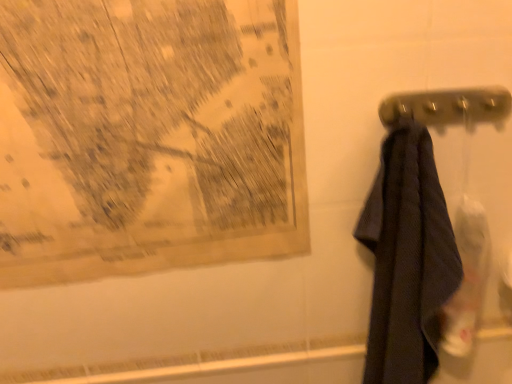
Where is `metallic gray towel bar at right`? metallic gray towel bar at right is located at coordinates (447, 107).

What do you see at coordinates (447, 107) in the screenshot?
I see `metallic gray towel bar at right` at bounding box center [447, 107].

Where is `yellowed paper map at upper left`? The height and width of the screenshot is (384, 512). yellowed paper map at upper left is located at coordinates (148, 136).

You are a GUI agent. You are given a task and a screenshot of the screen. Output one action in this format:
    pyautogui.click(x=<x>, y=<y>)
    Task: Click on the metallic gray towel bar at right
    
    Given the screenshot: What is the action you would take?
    pyautogui.click(x=447, y=107)

Looking at this image, is metallic gray towel bar at right far away from yellowed paper map at upper left?

No, metallic gray towel bar at right is not far from yellowed paper map at upper left.

From a real-world perspective, is metallic gray towel bar at right beneath yellowed paper map at upper left?

Incorrect, from a real-world perspective, metallic gray towel bar at right is higher than yellowed paper map at upper left.

Looking at this image, is metallic gray towel bar at right oriented away from yellowed paper map at upper left?

No.

Who is smaller, yellowed paper map at upper left or metallic gray towel bar at right?

With smaller size is metallic gray towel bar at right.

Which is closer, (3,141) or (423,123)?

Point (3,141) is positioned closer to the camera compared to point (423,123).

What's the angular difference between yellowed paper map at upper left and metallic gray towel bar at right's facing directions?

0.925 degrees separate the facing orientations of yellowed paper map at upper left and metallic gray towel bar at right.

I want to click on map that appears above the black textured towel at right (from a real-world perspective), so click(x=148, y=136).

In the image, is yellowed paper map at upper left on the left side or the right side of black textured towel at right?

Based on their positions, yellowed paper map at upper left is located to the left of black textured towel at right.

Is yellowed paper map at upper left facing away from black textured towel at right?

yellowed paper map at upper left does not have its back to black textured towel at right.

Measure the distance from yellowed paper map at upper left to black textured towel at right.

yellowed paper map at upper left is 12.06 inches from black textured towel at right.

Is metallic gray towel bar at right touching black textured towel at right?

metallic gray towel bar at right and black textured towel at right are not in contact.

From a real-world perspective, which object rests below the other?

black textured towel at right.

From the image's perspective, is metallic gray towel bar at right located above or below black textured towel at right?

From the image's perspective, metallic gray towel bar at right appears above black textured towel at right.

From the image's perspective, which is below, black textured towel at right or yellowed paper map at upper left?

black textured towel at right is shown below in the image.

Is point (424, 145) behind point (165, 10)?

Yes, point (424, 145) is behind point (165, 10).

How different are the orientations of black textured towel at right and yellowed paper map at upper left in degrees?

The angular difference between black textured towel at right and yellowed paper map at upper left is 1.87 degrees.

Is black textured towel at right next to metallic gray towel bar at right and touching it?

No, black textured towel at right is not touching metallic gray towel bar at right.

Is the depth of black textured towel at right greater than that of metallic gray towel bar at right?

No, it is not.

Is metallic gray towel bar at right a part of black textured towel at right?

Yes, metallic gray towel bar at right can be found within black textured towel at right.

Where is `towel bar on the right of the yellowed paper map at upper left`? towel bar on the right of the yellowed paper map at upper left is located at coordinates (447, 107).

Where is `map directly beneath the metallic gray towel bar at right (from a real-world perspective)`? Image resolution: width=512 pixels, height=384 pixels. map directly beneath the metallic gray towel bar at right (from a real-world perspective) is located at coordinates (148, 136).

From the image, which object appears to be farther from metallic gray towel bar at right, yellowed paper map at upper left or black textured towel at right?

yellowed paper map at upper left.

When comparing their distances from black textured towel at right, does yellowed paper map at upper left or metallic gray towel bar at right seem further?

yellowed paper map at upper left.

When comparing their distances from metallic gray towel bar at right, does black textured towel at right or yellowed paper map at upper left seem further?

yellowed paper map at upper left lies further to metallic gray towel bar at right than the other object.

Which object lies further to the anchor point yellowed paper map at upper left, metallic gray towel bar at right or black textured towel at right?

Among the two, metallic gray towel bar at right is located further to yellowed paper map at upper left.

Looking at the image, which one is located further to yellowed paper map at upper left, black textured towel at right or metallic gray towel bar at right?

metallic gray towel bar at right lies further to yellowed paper map at upper left than the other object.

Estimate the real-world distances between objects in this image. Which object is closer to black textured towel at right, metallic gray towel bar at right or yellowed paper map at upper left?

metallic gray towel bar at right is closer to black textured towel at right.

Locate an element on the screen. towel located between yellowed paper map at upper left and metallic gray towel bar at right in the left-right direction is located at coordinates (407, 259).